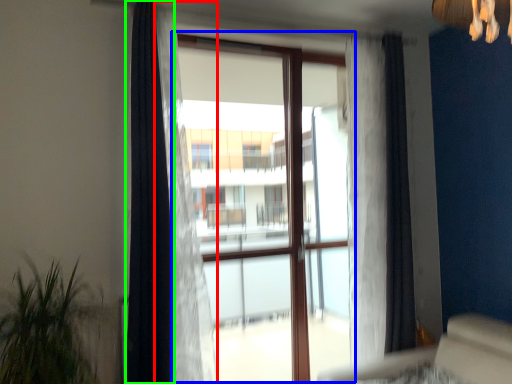
Question: Which is farther away from curtain (highlighted by a red box)? bay window (highlighted by a blue box) or curtain (highlighted by a green box)?

Choices:
 (A) bay window
 (B) curtain

Answer: (A)